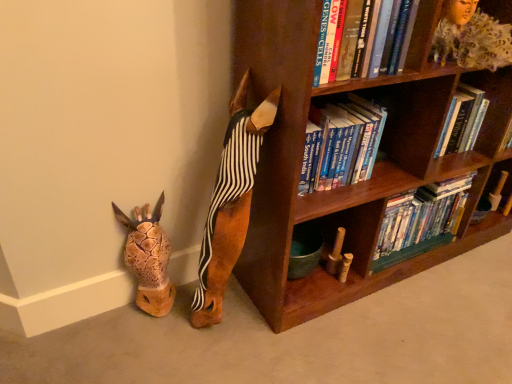
This screenshot has height=384, width=512. In order to click on vacant space underneath brown wooden dog at center, which appears as the 2th animal when viewed from the left (from a real-world perspective) in this screenshot , I will do `click(230, 310)`.